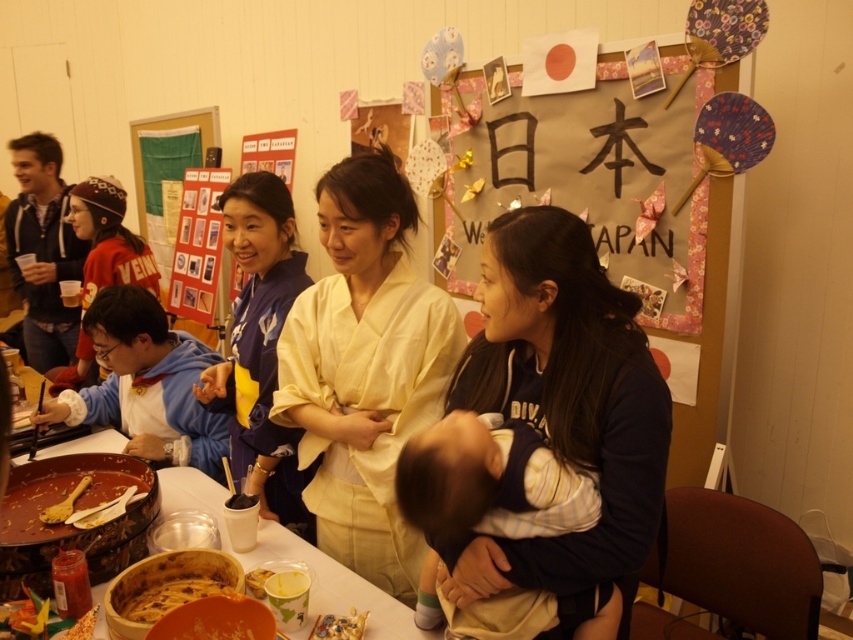
Question: Is blue fleece jacket at left positioned at the back of wooden spoon at lower left?

Choices:
 (A) yes
 (B) no

Answer: (A)

Question: Estimate the real-world distances between objects in this image. Which object is closer to the dark blue fleece at center?

Choices:
 (A) blue silk kimono at center
 (B) shiny plastic toy at lower center
 (C) wooden table at center

Answer: (C)

Question: Is matte cardboard signboard at upper center to the right of golden brown cake at center from the viewer's perspective?

Choices:
 (A) no
 (B) yes

Answer: (B)

Question: Among these points, which one is farthest from the camera?

Choices:
 (A) (99, 436)
 (B) (273, 492)
 (C) (497, 620)
 (D) (334, 616)

Answer: (A)

Question: Is soft beige baby at center thinner than matte red beanie at left?

Choices:
 (A) yes
 (B) no

Answer: (A)

Question: Which of the following is the closest to the observer?

Choices:
 (A) soft beige baby at center
 (B) matte red beanie at left
 (C) wooden spoon at lower left
 (D) matte black robe at left

Answer: (A)